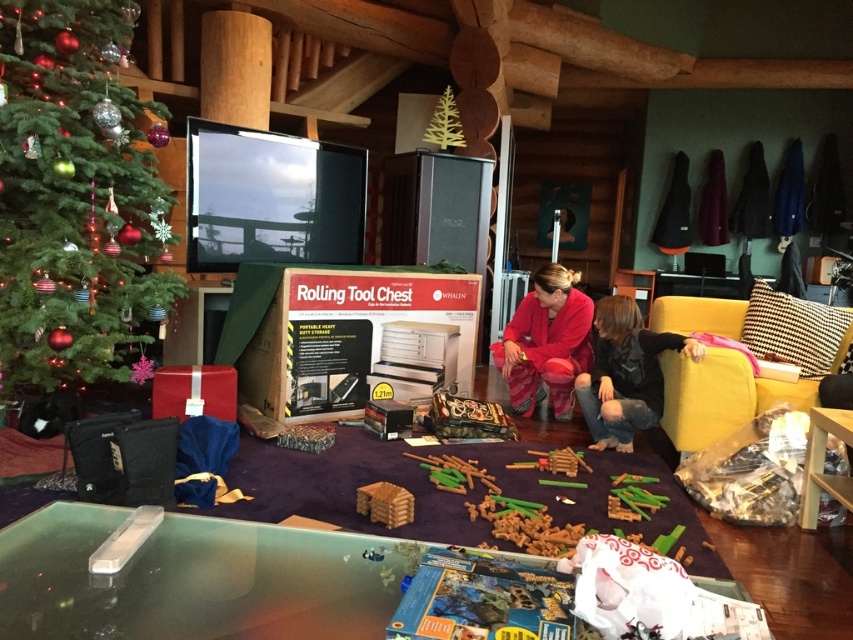
You are organizing a holiday party and need to place a decorative item on top of the black cotton shirt at lower right. However, you want to ensure it doesn not fall off. Can you determine if the velvet red pants at center are in a position that could block the shirt from being stable?

The black cotton shirt at lower right is below velvet red pants at center, so the pants are positioned above the shirt. This means placing an item on the shirt might be stable as the pants are not blocking it.

You are organizing a holiday gift wrapping station in the living room. You have a black cotton shirt at lower right and velvet red pants at center. Which item is positioned to the right of the other?

The black cotton shirt at lower right is to the right of velvet red pants at center.

You are standing in the holiday cabin living room and see a black cotton shirt at lower right. If you want to place a small ornament from the Christmas tree on the shirt, can you do so without moving the shirt?

The position of black cotton shirt at lower right is at point (625, 372). Since the shirt is stationary and the ornament can be placed directly on it, yes, you can place the ornament there without moving the shirt.